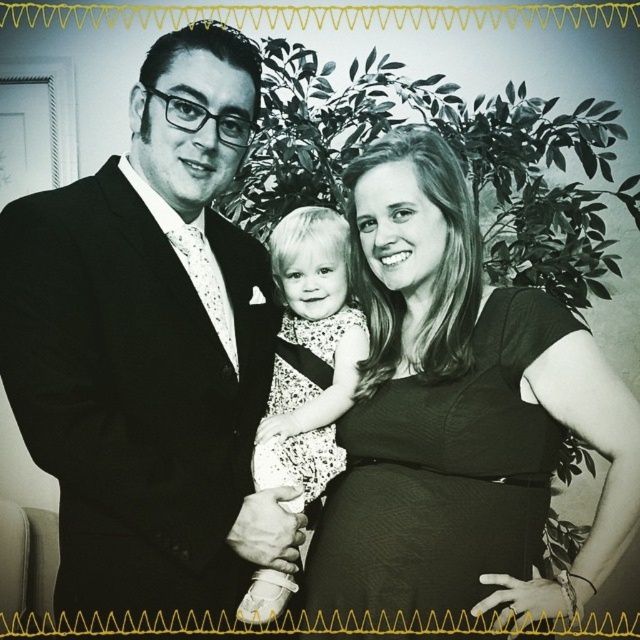
Is smooth black dress at center to the left of white dotted dress at center from the viewer's perspective?

Incorrect, smooth black dress at center is not on the left side of white dotted dress at center.

Locate an element on the screen. The image size is (640, 640). smooth black dress at center is located at coordinates (458, 417).

Which is in front, point (401, 192) or point (314, 332)?

Positioned in front is point (401, 192).

Where is `smooth black dress at center`? The width and height of the screenshot is (640, 640). smooth black dress at center is located at coordinates (458, 417).

Does black satin suit at left have a smaller size compared to white dotted dress at center?

Incorrect, black satin suit at left is not smaller in size than white dotted dress at center.

Which is above, black satin suit at left or white dotted dress at center?

Positioned higher is black satin suit at left.

Is point (204, 460) positioned in front of point (310, 445)?

That is True.

Locate an element on the screen. This screenshot has width=640, height=640. black satin suit at left is located at coordinates (150, 348).

Can you confirm if black satin suit at left is taller than smooth black dress at center?

Yes.

Who is more distant from viewer, (28,422) or (428,563)?

The point (428,563) is more distant.

At what (x,y) coordinates should I click in order to perform the action: click on black satin suit at left. Please return your answer as a coordinate pair (x, y). The height and width of the screenshot is (640, 640). Looking at the image, I should click on (150, 348).

Where is `black satin suit at left`? black satin suit at left is located at coordinates (150, 348).